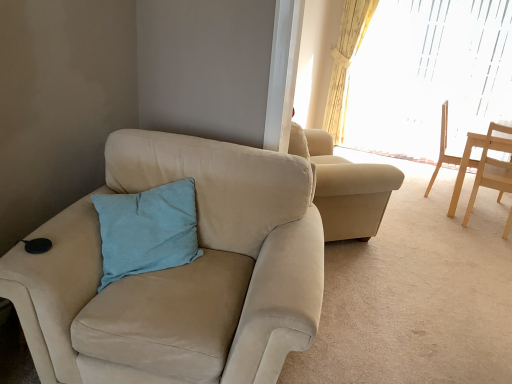
Question: Should I look upward or downward to see light blue fabric pillow at center?

Choices:
 (A) up
 (B) down

Answer: (B)

Question: Is light wood chair at right, which appears as the 1th chair when viewed from the right, surrounded by translucent glass window at upper right?

Choices:
 (A) no
 (B) yes

Answer: (A)

Question: Is the depth of translucent glass window at upper right greater than that of light wood chair at right, which is the second chair from back to front?

Choices:
 (A) yes
 (B) no

Answer: (A)

Question: Does translucent glass window at upper right have a lesser width compared to light wood chair at right, which is counted as the 3th chair, starting from the left?

Choices:
 (A) yes
 (B) no

Answer: (A)

Question: Does translucent glass window at upper right have a smaller size compared to light wood chair at right, which is the 2th chair from front to back?

Choices:
 (A) no
 (B) yes

Answer: (A)

Question: Is translucent glass window at upper right facing towards light wood chair at right, which is counted as the 3th chair, starting from the left?

Choices:
 (A) yes
 (B) no

Answer: (A)

Question: From a real-world perspective, is translucent glass window at upper right physically below light wood chair at right, which is the 2th chair from front to back?

Choices:
 (A) no
 (B) yes

Answer: (A)

Question: Is translucent glass window at upper right located outside yellow floral fabric curtain at upper right?

Choices:
 (A) no
 (B) yes

Answer: (B)

Question: Is translucent glass window at upper right at the left side of yellow floral fabric curtain at upper right?

Choices:
 (A) yes
 (B) no

Answer: (B)

Question: Can yellow floral fabric curtain at upper right be found inside translucent glass window at upper right?

Choices:
 (A) yes
 (B) no

Answer: (B)

Question: Does translucent glass window at upper right lie behind yellow floral fabric curtain at upper right?

Choices:
 (A) yes
 (B) no

Answer: (B)

Question: Is translucent glass window at upper right oriented away from yellow floral fabric curtain at upper right?

Choices:
 (A) no
 (B) yes

Answer: (B)

Question: Can you confirm if translucent glass window at upper right is smaller than yellow floral fabric curtain at upper right?

Choices:
 (A) no
 (B) yes

Answer: (A)

Question: Is suede beige chair at left, arranged as the 1th chair when viewed from the left, oriented away from light blue fabric pillow at center?

Choices:
 (A) yes
 (B) no

Answer: (A)